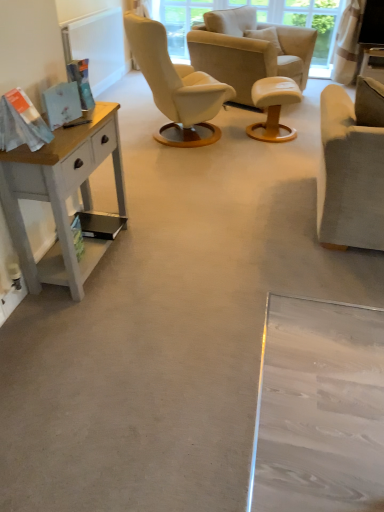
The image size is (384, 512). What are the coordinates of `vacant area that lies in front of white painted wood desk at left` in the screenshot? It's located at (84, 321).